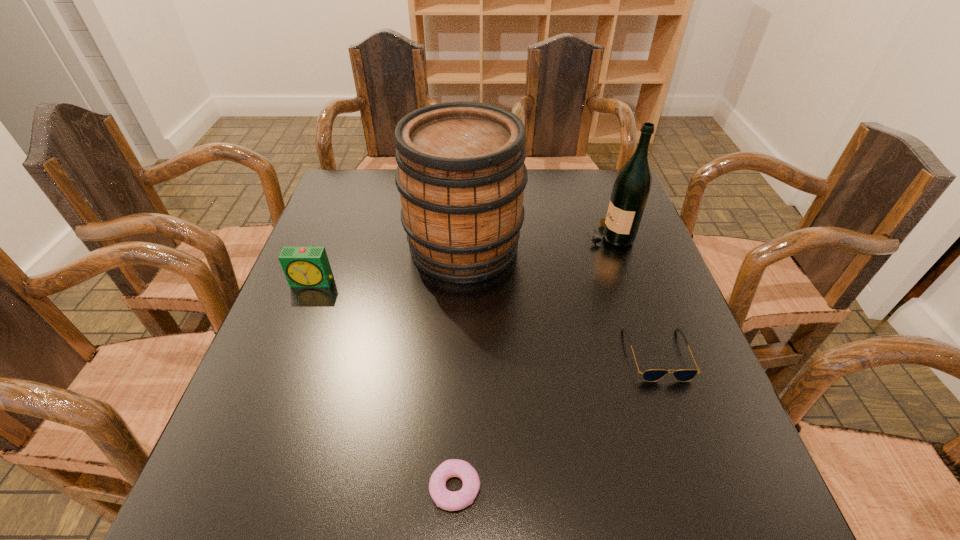
Locate an element on the screen. The height and width of the screenshot is (540, 960). free space at the right edge is located at coordinates (676, 419).

Where is `vacant space at the far left corner`? Image resolution: width=960 pixels, height=540 pixels. vacant space at the far left corner is located at coordinates (326, 204).

In the image, there is a desktop. In order to click on vacant space at the near left corner in this screenshot , I will do `click(228, 501)`.

You are a GUI agent. You are given a task and a screenshot of the screen. Output one action in this format:
    pyautogui.click(x=<x>, y=<y>)
    Task: Click on the empty space between the cider and the second shortest object
    The height and width of the screenshot is (540, 960).
    Given the screenshot: What is the action you would take?
    pyautogui.click(x=561, y=300)

This screenshot has height=540, width=960. In order to click on vacant space that is in between the doughnut and the wine bottle in this screenshot , I will do (532, 362).

This screenshot has height=540, width=960. Find the location of `vacant space that's between the cider and the doughnut`. vacant space that's between the cider and the doughnut is located at coordinates (460, 367).

The width and height of the screenshot is (960, 540). I want to click on free spot between the third shortest object and the second nearest object, so click(x=485, y=318).

Where is `vacant region between the nearest object and the cider`? The height and width of the screenshot is (540, 960). vacant region between the nearest object and the cider is located at coordinates (460, 367).

Where is `free space between the wine bottle and the cider`? The width and height of the screenshot is (960, 540). free space between the wine bottle and the cider is located at coordinates (537, 241).

Find the location of a particular element. The width and height of the screenshot is (960, 540). free space between the wine bottle and the second nearest object is located at coordinates (634, 295).